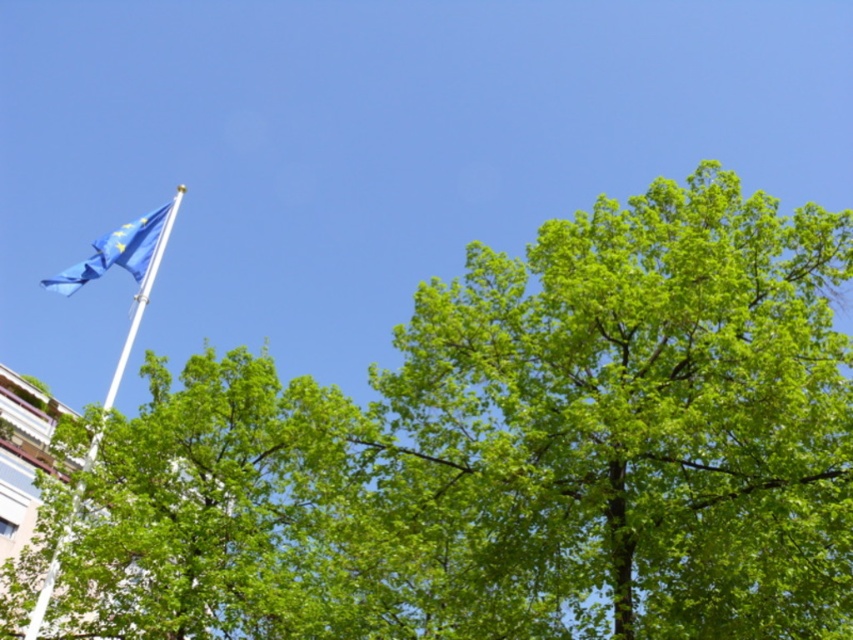
Question: Among these objects, which one is farthest from the camera?

Choices:
 (A) white metallic flag pole at upper left
 (B) green leafy tree at center

Answer: (A)

Question: Observing the image, what is the correct spatial positioning of green leafy tree at center in reference to white metallic flag pole at upper left?

Choices:
 (A) left
 (B) right

Answer: (B)

Question: Can you confirm if green leafy tree at upper left is wider than blue fabric flag at upper left?

Choices:
 (A) yes
 (B) no

Answer: (B)

Question: Which object appears farthest from the camera in this image?

Choices:
 (A) white metallic flag pole at upper left
 (B) green leafy tree at center
 (C) blue fabric flag at upper left

Answer: (C)

Question: Does green leafy tree at center have a smaller size compared to white metallic flag pole at upper left?

Choices:
 (A) yes
 (B) no

Answer: (A)

Question: Which point appears closest to the camera in this image?

Choices:
 (A) (129, 225)
 (B) (131, 442)
 (C) (799, 253)

Answer: (C)